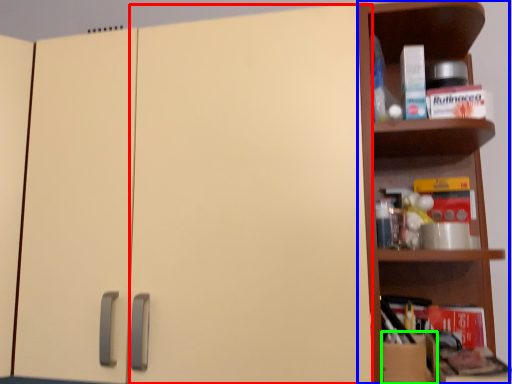
Question: Which is farther away from door (highlighted by a red box)? shelf (highlighted by a blue box) or cardboard box (highlighted by a green box)?

Choices:
 (A) shelf
 (B) cardboard box

Answer: (B)